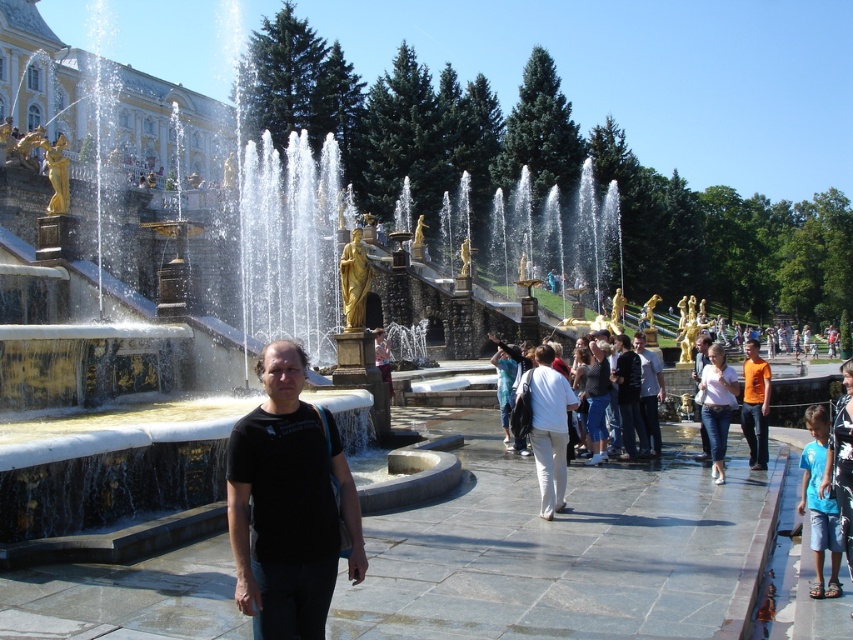
How distant is denim jeans at center from orange cotton t-shirt at center?

denim jeans at center and orange cotton t-shirt at center are 2.24 meters apart.

Locate an element on the screen. This screenshot has height=640, width=853. denim jeans at center is located at coordinates (717, 404).

What are the coordinates of `denim jeans at center` in the screenshot? It's located at (717, 404).

Which is above, black matte t-shirt at center or denim jeans at center?

denim jeans at center is higher up.

This screenshot has width=853, height=640. What do you see at coordinates (288, 504) in the screenshot?
I see `black matte t-shirt at center` at bounding box center [288, 504].

Locate an element on the screen. The height and width of the screenshot is (640, 853). black matte t-shirt at center is located at coordinates (288, 504).

Find the location of a particular element. The width and height of the screenshot is (853, 640). black matte t-shirt at center is located at coordinates [x=288, y=504].

Which is more to the left, black matte t-shirt at center or orange cotton t-shirt at center?

black matte t-shirt at center is more to the left.

Locate an element on the screen. The image size is (853, 640). black matte t-shirt at center is located at coordinates (288, 504).